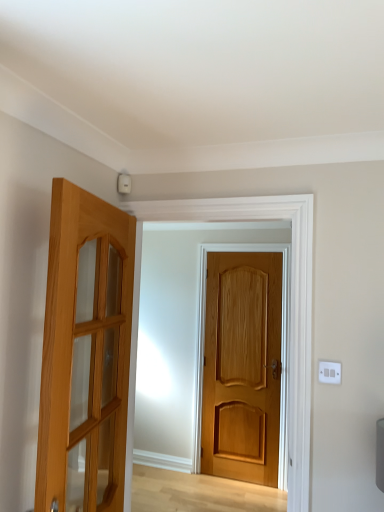
Image resolution: width=384 pixels, height=512 pixels. Describe the element at coordinates (245, 367) in the screenshot. I see `light brown wooden door at center, acting as the 2th door starting from the left` at that location.

The height and width of the screenshot is (512, 384). I want to click on white plastic switch at upper right, so click(329, 372).

Find the location of `door behind the white plastic switch at upper right`. door behind the white plastic switch at upper right is located at coordinates (245, 367).

Measure the distance from white plastic switch at upper right to light brown wooden door at center, the 1th door positioned from the back.

They are 7.09 feet apart.

Is white plastic switch at upper right located outside light brown wooden door at center, the 1th door positioned from the back?

Absolutely, white plastic switch at upper right is external to light brown wooden door at center, the 1th door positioned from the back.

Between light brown wooden door at left, positioned as the first door in left-to-right order, and white plastic switch at upper right, which one appears on the left side from the viewer's perspective?

From the viewer's perspective, light brown wooden door at left, positioned as the first door in left-to-right order, appears more on the left side.

Is light brown wooden door at left, placed as the 1th door when sorted from front to back, oriented away from white plastic switch at upper right?

No, light brown wooden door at left, placed as the 1th door when sorted from front to back, is not facing the opposite direction of white plastic switch at upper right.

Consider the image. Which is correct: light brown wooden door at left, placed as the 1th door when sorted from front to back, is inside white plastic switch at upper right, or outside of it?

light brown wooden door at left, placed as the 1th door when sorted from front to back, is located beyond the bounds of white plastic switch at upper right.

Is light brown wooden door at left, placed as the 1th door when sorted from front to back, wider or thinner than white plastic switch at upper right?

light brown wooden door at left, placed as the 1th door when sorted from front to back, is wider than white plastic switch at upper right.

Is white plastic switch at upper right oriented away from light brown wooden door at left, placed as the 1th door when sorted from front to back?

white plastic switch at upper right is not turned away from light brown wooden door at left, placed as the 1th door when sorted from front to back.

From the image's perspective, is white plastic switch at upper right under light brown wooden door at left, which appears as the second door when viewed from the right?

Yes, from the image's perspective, white plastic switch at upper right is beneath light brown wooden door at left, which appears as the second door when viewed from the right.

How distant is white plastic switch at upper right from light brown wooden door at left, which appears as the second door when viewed from the right?

A distance of 37.07 inches exists between white plastic switch at upper right and light brown wooden door at left, which appears as the second door when viewed from the right.

Does white plastic switch at upper right come behind light brown wooden door at left, positioned as the first door in left-to-right order?

Yes, white plastic switch at upper right is behind light brown wooden door at left, positioned as the first door in left-to-right order.

Does light brown wooden door at center, the 1th door positioned from the back, appear on the left side of white plastic switch at upper right?

Yes.

Considering the relative sizes of light brown wooden door at center, the first door viewed from the right, and white plastic switch at upper right in the image provided, is light brown wooden door at center, the first door viewed from the right, wider than white plastic switch at upper right?

Indeed, light brown wooden door at center, the first door viewed from the right, has a greater width compared to white plastic switch at upper right.

From their relative heights in the image, would you say light brown wooden door at center, arranged as the second door when viewed from the front, is taller or shorter than white plastic switch at upper right?

light brown wooden door at center, arranged as the second door when viewed from the front, is taller than white plastic switch at upper right.

From a real-world perspective, count 2nd doors downward from the white plastic switch at upper right and point to it. Please provide its 2D coordinates.

[(245, 367)]

Looking at the image, does light brown wooden door at center, acting as the 2th door starting from the left, seem bigger or smaller compared to light brown wooden door at left, placed as the 1th door when sorted from front to back?

In the image, light brown wooden door at center, acting as the 2th door starting from the left, appears to be smaller than light brown wooden door at left, placed as the 1th door when sorted from front to back.

Is light brown wooden door at center, the 1th door positioned from the back, aimed at light brown wooden door at left, positioned as the first door in left-to-right order?

Yes, light brown wooden door at center, the 1th door positioned from the back, is turned towards light brown wooden door at left, positioned as the first door in left-to-right order.

Is light brown wooden door at center, the 1th door positioned from the back, touching light brown wooden door at left, marked as the 2th door in a back-to-front arrangement?

light brown wooden door at center, the 1th door positioned from the back, is not next to light brown wooden door at left, marked as the 2th door in a back-to-front arrangement, and they're not touching.

Is light brown wooden door at center, arranged as the second door when viewed from the front, spatially inside light brown wooden door at left, which appears as the second door when viewed from the right, or outside of it?

light brown wooden door at center, arranged as the second door when viewed from the front, exists outside the volume of light brown wooden door at left, which appears as the second door when viewed from the right.

From a real-world perspective, is light brown wooden door at left, marked as the 2th door in a back-to-front arrangement, physically above light brown wooden door at center, acting as the 2th door starting from the left?

Yes, from a real-world perspective, light brown wooden door at left, marked as the 2th door in a back-to-front arrangement, is on top of light brown wooden door at center, acting as the 2th door starting from the left.

Which is more to the right, light brown wooden door at left, marked as the 2th door in a back-to-front arrangement, or light brown wooden door at center, the first door viewed from the right?

From the viewer's perspective, light brown wooden door at center, the first door viewed from the right, appears more on the right side.

From the image's perspective, does light brown wooden door at left, marked as the 2th door in a back-to-front arrangement, appear higher than light brown wooden door at center, acting as the 2th door starting from the left?

Yes, from the image's perspective, light brown wooden door at left, marked as the 2th door in a back-to-front arrangement, is over light brown wooden door at center, acting as the 2th door starting from the left.

Which object is further away from the camera taking this photo, light brown wooden door at left, placed as the 1th door when sorted from front to back, or light brown wooden door at center, the 1th door positioned from the back?

light brown wooden door at center, the 1th door positioned from the back.

Identify the location of door below the white plastic switch at upper right (from the image's perspective). (245, 367).

This screenshot has height=512, width=384. I want to click on door that appears above the white plastic switch at upper right (from the image's perspective), so click(x=85, y=354).

Consider the image. Estimate the real-world distances between objects in this image. Which object is closer to white plastic switch at upper right, light brown wooden door at left, which appears as the second door when viewed from the right, or light brown wooden door at center, acting as the 2th door starting from the left?

light brown wooden door at left, which appears as the second door when viewed from the right, is closer to white plastic switch at upper right.

Based on their spatial positions, is white plastic switch at upper right or light brown wooden door at center, acting as the 2th door starting from the left, further from light brown wooden door at left, marked as the 2th door in a back-to-front arrangement?

Based on the image, light brown wooden door at center, acting as the 2th door starting from the left, appears to be further to light brown wooden door at left, marked as the 2th door in a back-to-front arrangement.

From the image, which object appears to be farther from light brown wooden door at left, marked as the 2th door in a back-to-front arrangement, light brown wooden door at center, acting as the 2th door starting from the left, or white plastic switch at upper right?

Among the two, light brown wooden door at center, acting as the 2th door starting from the left, is located further to light brown wooden door at left, marked as the 2th door in a back-to-front arrangement.

Based on their spatial positions, is light brown wooden door at center, acting as the 2th door starting from the left, or light brown wooden door at left, positioned as the first door in left-to-right order, closer to white plastic switch at upper right?

Among the two, light brown wooden door at left, positioned as the first door in left-to-right order, is located nearer to white plastic switch at upper right.

Which object lies nearer to the anchor point light brown wooden door at center, arranged as the second door when viewed from the front, white plastic switch at upper right or light brown wooden door at left, placed as the 1th door when sorted from front to back?

The object closer to light brown wooden door at center, arranged as the second door when viewed from the front, is white plastic switch at upper right.

Considering their positions, is light brown wooden door at left, placed as the 1th door when sorted from front to back, positioned further to light brown wooden door at center, acting as the 2th door starting from the left, than white plastic switch at upper right?

light brown wooden door at left, placed as the 1th door when sorted from front to back, is positioned further to the anchor light brown wooden door at center, acting as the 2th door starting from the left.

Where is `electric outlet located between light brown wooden door at left, marked as the 2th door in a back-to-front arrangement, and light brown wooden door at center, the 1th door positioned from the back, in the depth direction`? The width and height of the screenshot is (384, 512). electric outlet located between light brown wooden door at left, marked as the 2th door in a back-to-front arrangement, and light brown wooden door at center, the 1th door positioned from the back, in the depth direction is located at coordinates (329, 372).